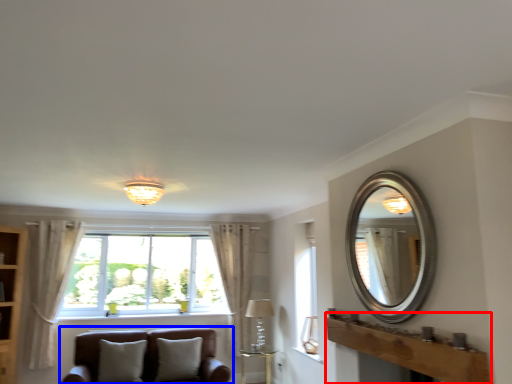
Question: Which object appears closest to the camera in this image, mantle (highlighted by a red box) or studio couch (highlighted by a blue box)?

Choices:
 (A) mantle
 (B) studio couch

Answer: (A)